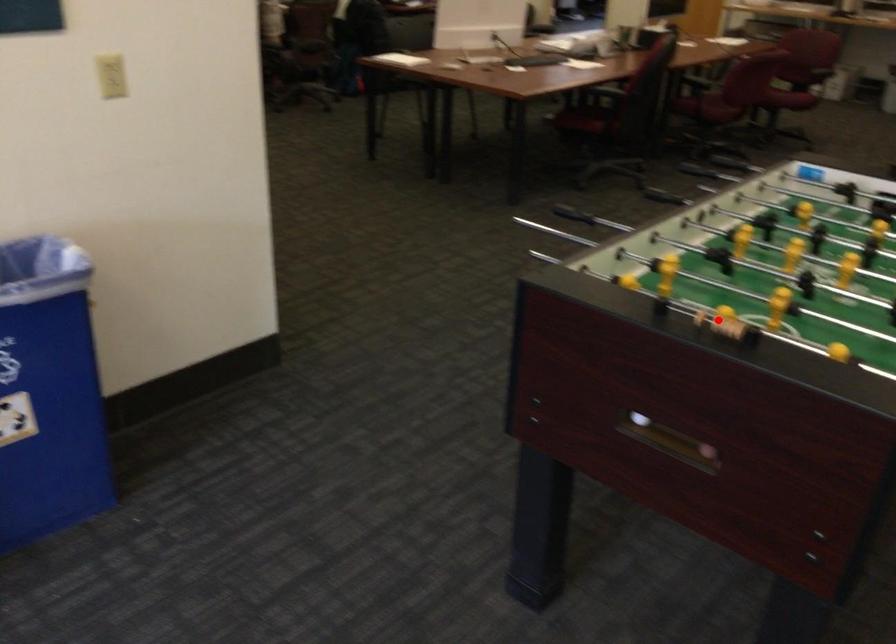
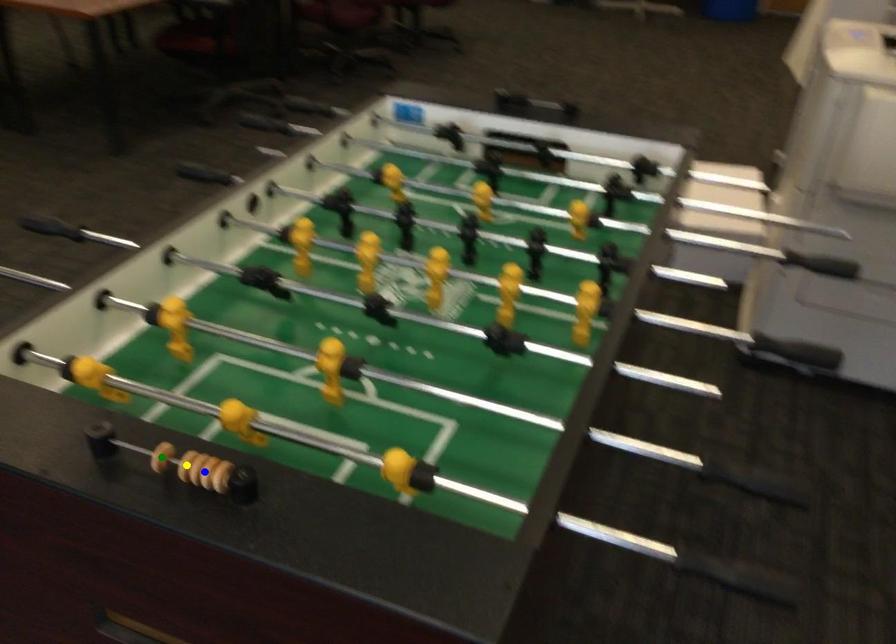
Question: I am providing you with two images of the same scene from different viewpoints. A red point is marked on the first image. You are given multiple points on the second image. Which point in image 2 represents the same 3d spot as the red point in image 1?

Choices:
 (A) yellow point
 (B) blue point
 (C) green point

Answer: (A)